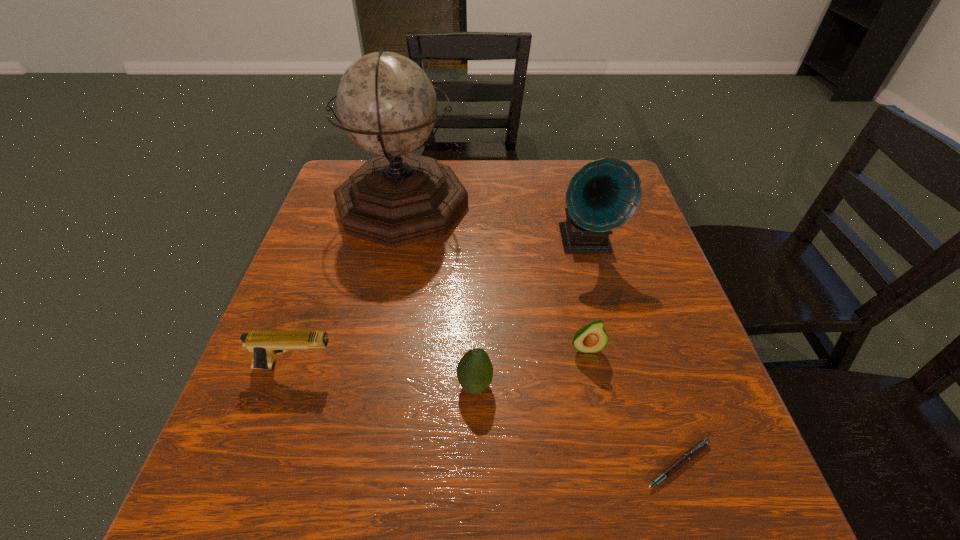
Image resolution: width=960 pixels, height=540 pixels. I want to click on free region that satisfies the following two spatial constraints: 1. on the surface of the tallest object; 2. on the right side of the left avocado, so pos(365,385).